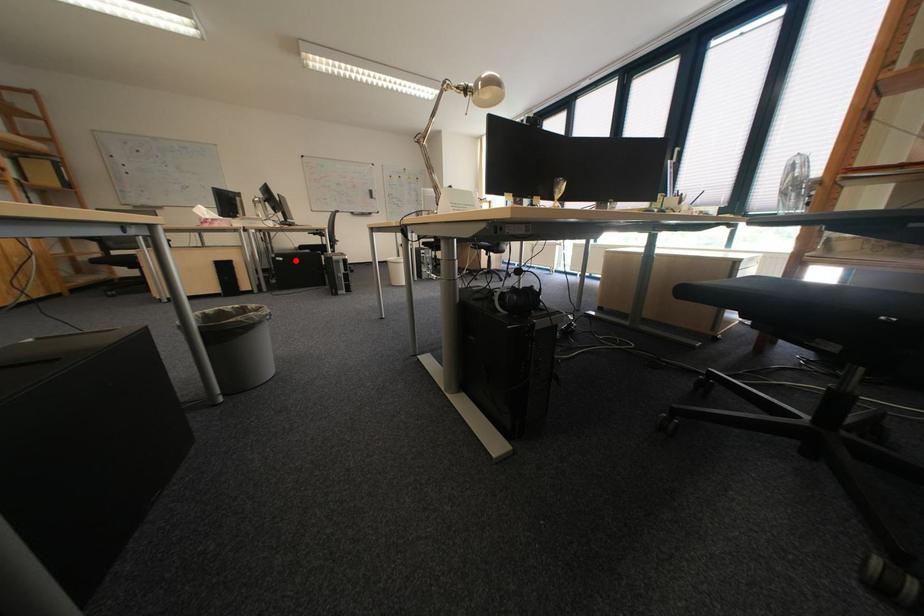
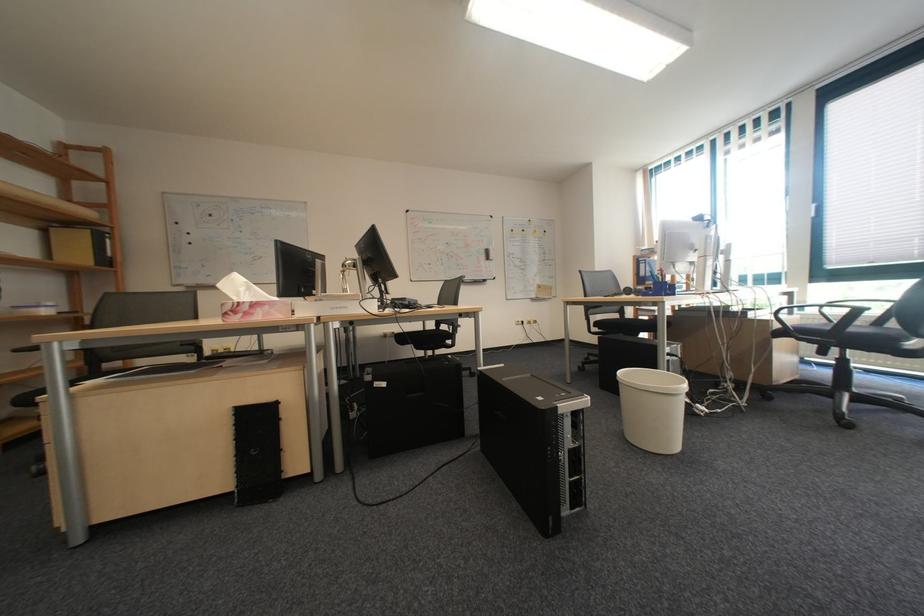
Question: I am providing you with two images of the same scene from different viewpoints. A red point is shown in image1. For the corresponding object point in image2, is it positioned nearer or farther from the camera?

Choices:
 (A) Nearer
 (B) Farther

Answer: (B)